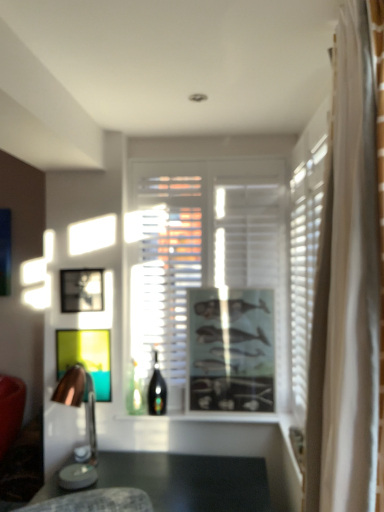
This screenshot has height=512, width=384. Find the location of `free space that is in between matte black picture frame at center, acting as the 1th picture frame starting from the right, and shiny glass bottle at center`. free space that is in between matte black picture frame at center, acting as the 1th picture frame starting from the right, and shiny glass bottle at center is located at coordinates (208, 418).